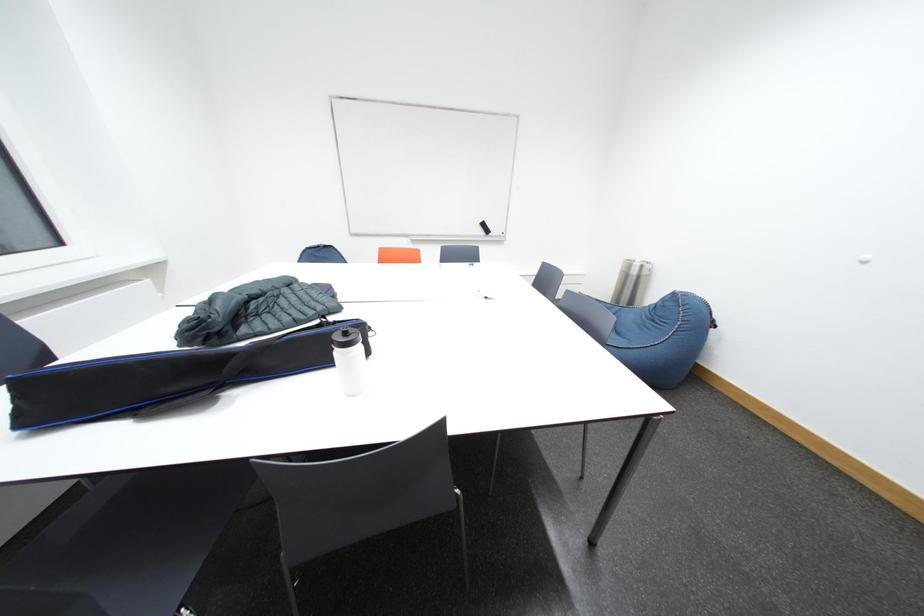
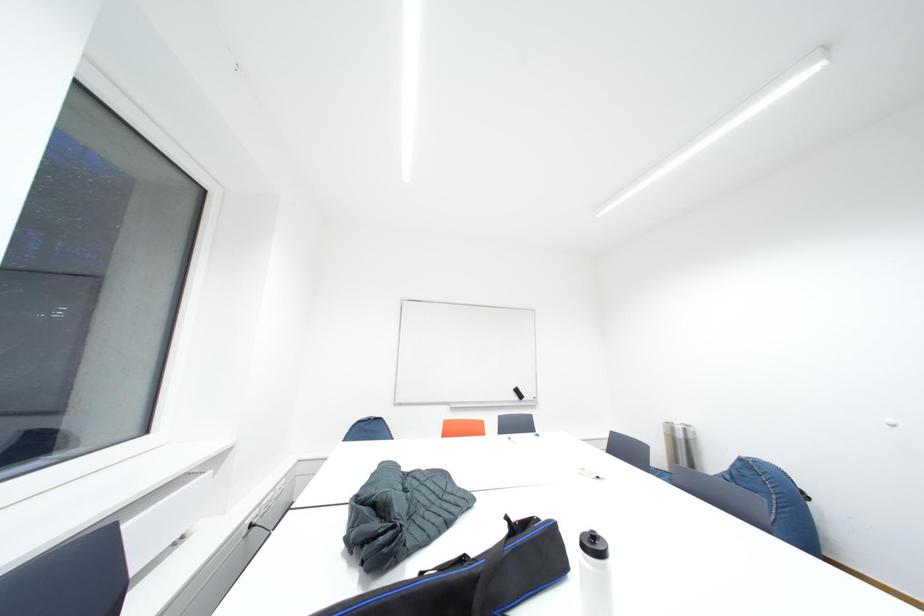
Question: Based on the continuous images, in which direction is the camera rotating? Reply with the corresponding letter.

Choices:
 (A) Left
 (B) Right
 (C) Up
 (D) Down

Answer: (C)